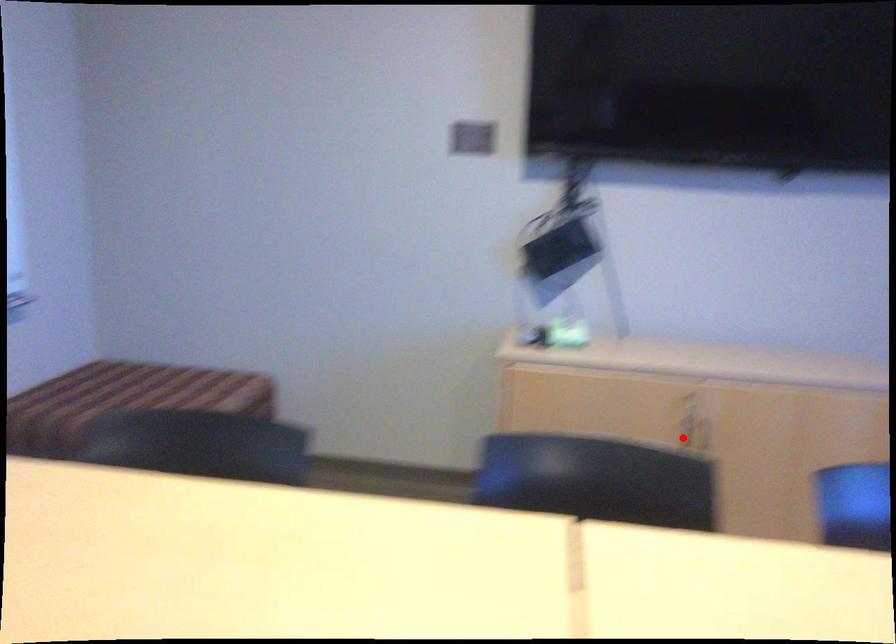
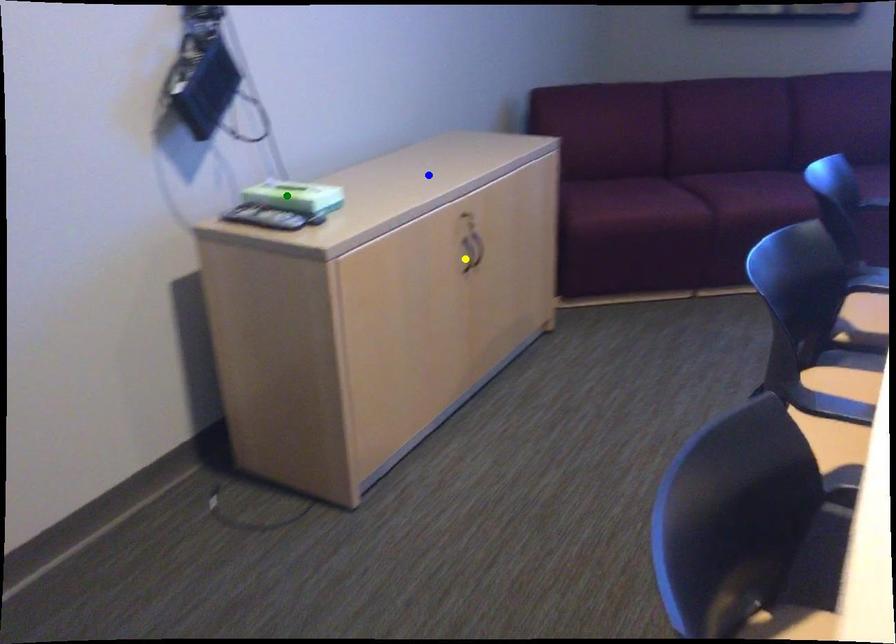
Question: I am providing you with two images of the same scene from different viewpoints. A red point is marked on the first image. You are given multiple points on the second image. Which point in image 2 represents the same 3d spot as the red point in image 1?

Choices:
 (A) blue point
 (B) green point
 (C) yellow point

Answer: (C)